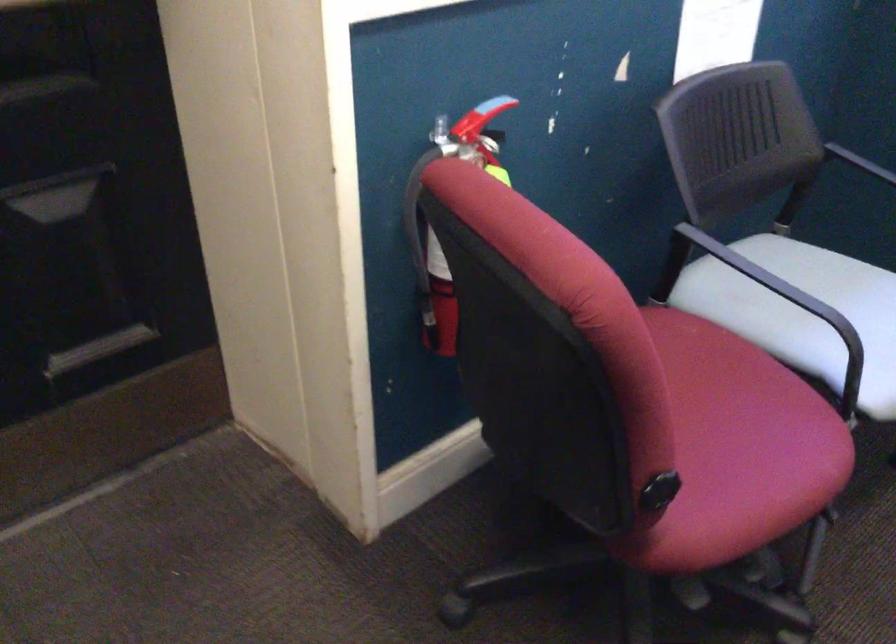
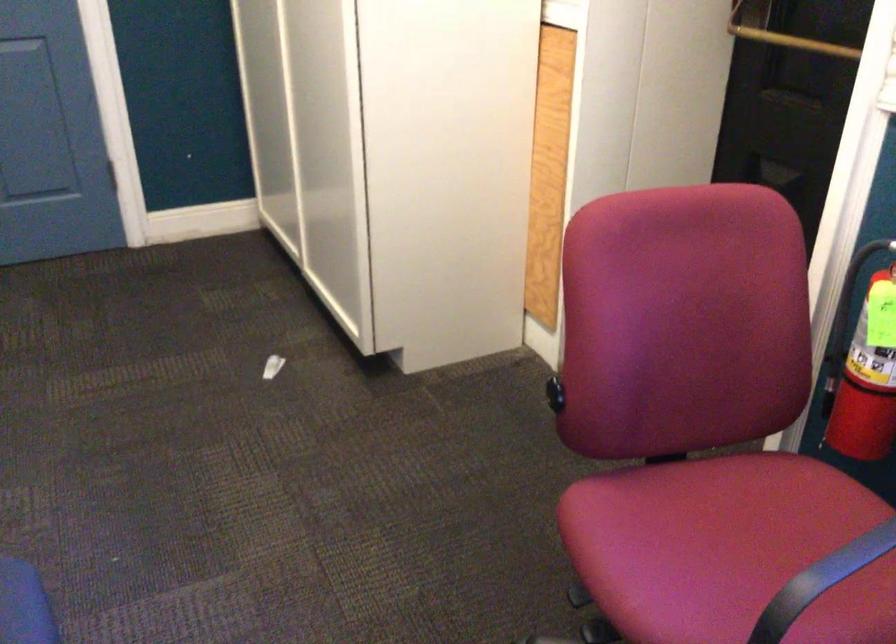
Find the pixel in the second image that matches [653,486] in the first image.

(555, 393)